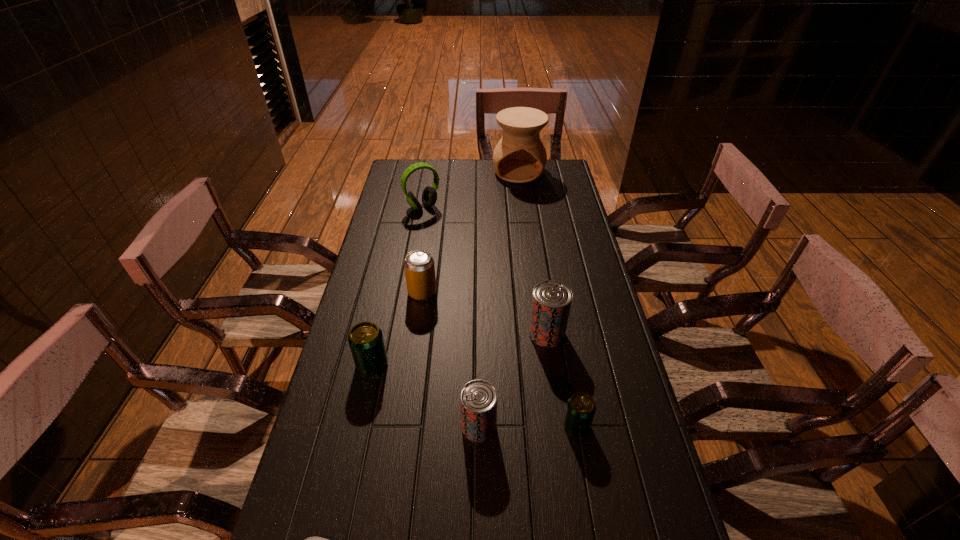
The height and width of the screenshot is (540, 960). What are the coordinates of `cream pottery` in the screenshot? It's located at (519, 157).

This screenshot has width=960, height=540. Identify the location of the farthest object. (519, 157).

Find the location of `green headset`. green headset is located at coordinates (429, 196).

Locate an element on the screen. This screenshot has width=960, height=540. headset is located at coordinates (429, 196).

Locate an element on the screen. The height and width of the screenshot is (540, 960). the fourth farthest object is located at coordinates (551, 302).

Where is `the right red beer can`? The image size is (960, 540). the right red beer can is located at coordinates (551, 302).

This screenshot has height=540, width=960. Identify the location of pop (soda). (419, 267).

Where is `the left green beer can`? the left green beer can is located at coordinates (365, 339).

Find the location of a particular element. the bigger green beer can is located at coordinates [365, 339].

The width and height of the screenshot is (960, 540). In order to click on the smaller red beer can in this screenshot , I will do `click(478, 399)`.